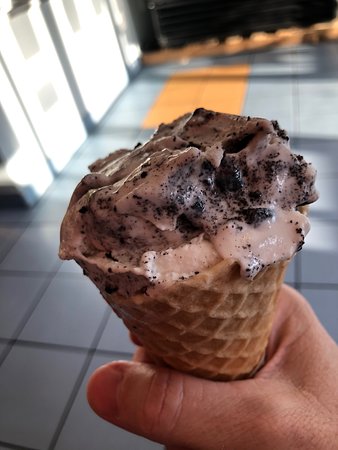
Where is `floor mat`? Image resolution: width=338 pixels, height=450 pixels. floor mat is located at coordinates (200, 76).